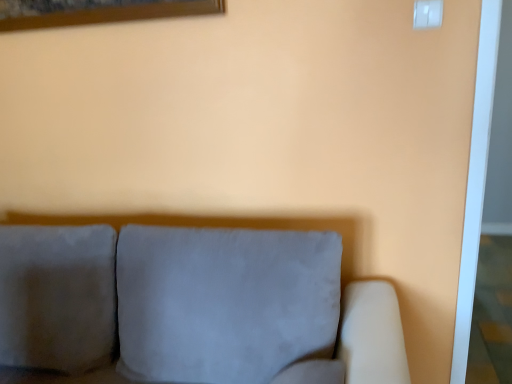
Measure the distance between point (x=240, y=339) and camera.

The distance of point (x=240, y=339) from camera is 3.97 feet.

Describe the element at coordinates (193, 306) in the screenshot. The height and width of the screenshot is (384, 512). I see `suede gray couch at center` at that location.

The image size is (512, 384). I want to click on suede gray couch at center, so click(193, 306).

In order to face white plastic switch at upper right, should I rotate leftwards or rightwards?

You should look right and rotate roughly 22.562 degrees.

The height and width of the screenshot is (384, 512). In order to click on white plastic switch at upper right in this screenshot , I will do `click(426, 13)`.

What do you see at coordinates (426, 13) in the screenshot? This screenshot has height=384, width=512. I see `white plastic switch at upper right` at bounding box center [426, 13].

What is the approximate width of white plastic switch at upper right?

1.81 centimeters.

Image resolution: width=512 pixels, height=384 pixels. Identify the location of suede gray couch at center. (193, 306).

Consider the image. Considering the positions of objects suede gray couch at center and white plastic switch at upper right in the image provided, who is more to the right, suede gray couch at center or white plastic switch at upper right?

From the viewer's perspective, white plastic switch at upper right appears more on the right side.

Which object is more forward, suede gray couch at center or white plastic switch at upper right?

Positioned in front is suede gray couch at center.

Does point (385, 315) appear closer or farther from the camera than point (437, 15)?

Clearly, point (385, 315) is more distant from the camera than point (437, 15).

From the image's perspective, is suede gray couch at center positioned above or below white plastic switch at upper right?

suede gray couch at center is below white plastic switch at upper right.

From a real-world perspective, does suede gray couch at center stand above white plastic switch at upper right?

Incorrect, from a real-world perspective, suede gray couch at center is lower than white plastic switch at upper right.

Is suede gray couch at center thinner than white plastic switch at upper right?

No, suede gray couch at center is not thinner than white plastic switch at upper right.

Which of these two, suede gray couch at center or white plastic switch at upper right, stands taller?

suede gray couch at center is taller.

Can you confirm if suede gray couch at center is smaller than white plastic switch at upper right?

Incorrect, suede gray couch at center is not smaller in size than white plastic switch at upper right.

Is white plastic switch at upper right inside suede gray couch at center?

No.

Would you consider suede gray couch at center to be distant from white plastic switch at upper right?

That's right, there is a large distance between suede gray couch at center and white plastic switch at upper right.

Is suede gray couch at center oriented towards white plastic switch at upper right?

No, suede gray couch at center is not aimed at white plastic switch at upper right.

How different are the orientations of suede gray couch at center and white plastic switch at upper right in degrees?

The angular difference between suede gray couch at center and white plastic switch at upper right is 1.11 degrees.

You are a GUI agent. You are given a task and a screenshot of the screen. Output one action in this format:
    pyautogui.click(x=<x>, y=<y>)
    Task: Click on the electric outlet that appears on the right of suede gray couch at center
    The width and height of the screenshot is (512, 384).
    Given the screenshot: What is the action you would take?
    pyautogui.click(x=426, y=13)

Can you confirm if white plastic switch at upper right is positioned to the right of suede gray couch at center?

Indeed, white plastic switch at upper right is positioned on the right side of suede gray couch at center.

Relative to suede gray couch at center, is white plastic switch at upper right in front or behind?

Visually, white plastic switch at upper right is located behind suede gray couch at center.

Which is further, [419,0] or [244,375]?

The point [244,375] is more distant.

From the image's perspective, does white plastic switch at upper right appear higher than suede gray couch at center?

Yes, from the image's perspective, white plastic switch at upper right is above suede gray couch at center.

From a real-world perspective, is white plastic switch at upper right positioned above or below suede gray couch at center?

Clearly, from a real-world perspective, white plastic switch at upper right is above suede gray couch at center.

Which object is wider, white plastic switch at upper right or suede gray couch at center?

With larger width is suede gray couch at center.

Does white plastic switch at upper right have a greater height compared to suede gray couch at center?

No.

Does white plastic switch at upper right have a larger size compared to suede gray couch at center?

No.

Which is correct: white plastic switch at upper right is inside suede gray couch at center, or outside of it?

white plastic switch at upper right lies outside suede gray couch at center.

Is white plastic switch at upper right far from suede gray couch at center?

Yes, white plastic switch at upper right is far from suede gray couch at center.

Is white plastic switch at upper right positioned with its back to suede gray couch at center?

No, white plastic switch at upper right's orientation is not away from suede gray couch at center.

How many degrees apart are the facing directions of white plastic switch at upper right and suede gray couch at center?

The angle between the facing direction of white plastic switch at upper right and the facing direction of suede gray couch at center is 1.11 degrees.

Locate an element on the screen. studio couch that is on the left side of white plastic switch at upper right is located at coordinates (193, 306).

Locate an element on the screen. This screenshot has width=512, height=384. electric outlet behind the suede gray couch at center is located at coordinates (426, 13).

Where is `electric outlet lying above the suede gray couch at center (from the image's perspective)`? The height and width of the screenshot is (384, 512). electric outlet lying above the suede gray couch at center (from the image's perspective) is located at coordinates (426, 13).